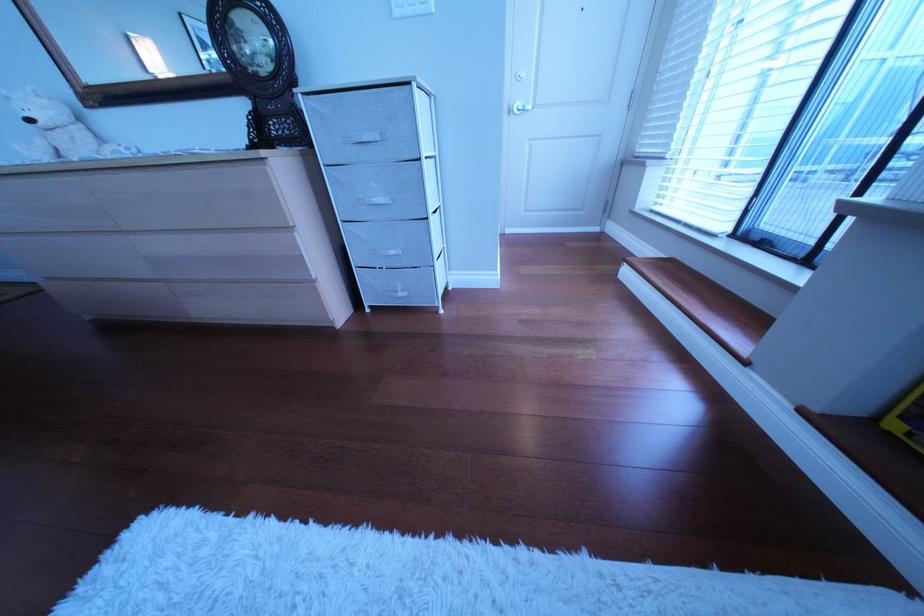
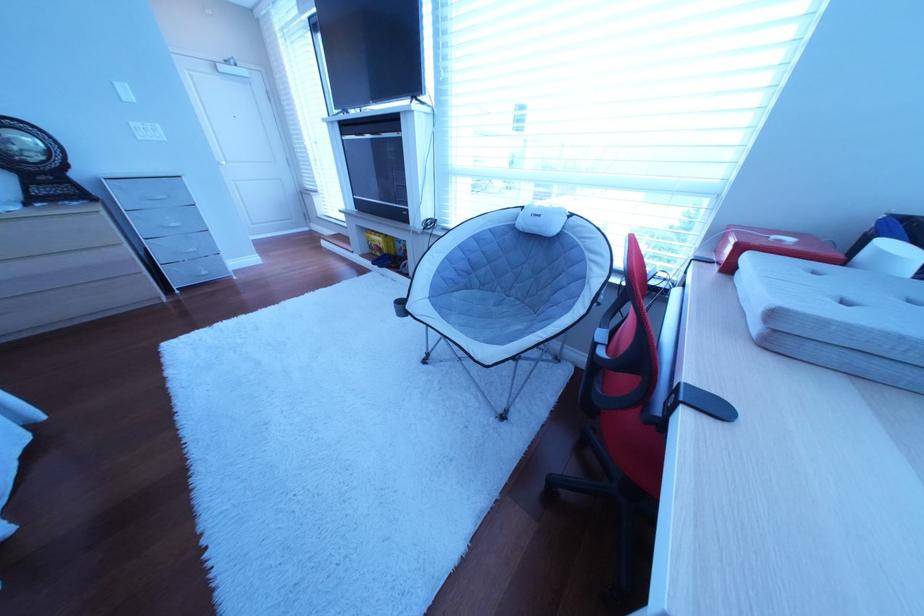
In the second image, find the point that corresponds to point (407, 254) in the first image.

(207, 252)